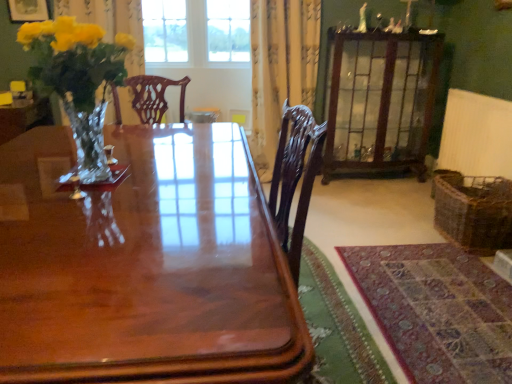
Image resolution: width=512 pixels, height=384 pixels. In order to click on unoccupied space behind shiny glass vase with yellow flowers at left in this screenshot , I will do `click(130, 153)`.